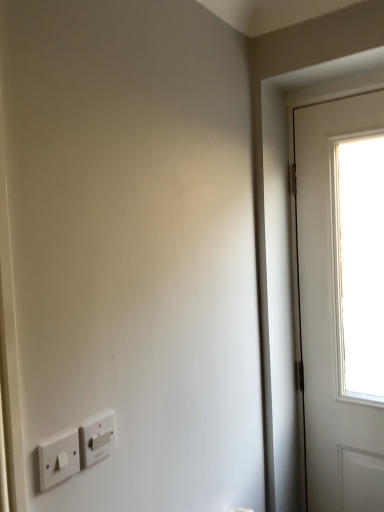
Question: Is point (51, 464) closer or farther from the camera than point (109, 445)?

Choices:
 (A) closer
 (B) farther

Answer: (A)

Question: Considering the positions of white plastic light switch at lower left, the second light switch viewed from the back, and white plastic light switch at lower left, which ranks as the first light switch in back-to-front order, in the image, is white plastic light switch at lower left, the second light switch viewed from the back, bigger or smaller than white plastic light switch at lower left, which ranks as the first light switch in back-to-front order,?

Choices:
 (A) big
 (B) small

Answer: (A)

Question: Looking at their shapes, would you say white plastic light switch at lower left, the second light switch viewed from the back, is wider or thinner than white plastic light switch at lower left, which is counted as the first light switch, starting from the right?

Choices:
 (A) wide
 (B) thin

Answer: (B)

Question: Is white plastic light switch at lower left, which ranks as the first light switch in back-to-front order, inside or outside of white plastic light switch at lower left, which ranks as the 1th light switch in left-to-right order?

Choices:
 (A) outside
 (B) inside

Answer: (A)

Question: In the image, is white plastic light switch at lower left, which ranks as the first light switch in back-to-front order, positioned in front of or behind white plastic light switch at lower left, the second light switch viewed from the back?

Choices:
 (A) behind
 (B) front

Answer: (A)

Question: From their relative heights in the image, would you say white plastic light switch at lower left, which ranks as the 2th light switch in left-to-right order, is taller or shorter than white plastic light switch at lower left, the second light switch viewed from the back?

Choices:
 (A) short
 (B) tall

Answer: (B)

Question: Looking at the image, does white plastic light switch at lower left, which ranks as the 2th light switch in left-to-right order, seem bigger or smaller compared to white plastic light switch at lower left, which is the 1th light switch in front-to-back order?

Choices:
 (A) big
 (B) small

Answer: (B)